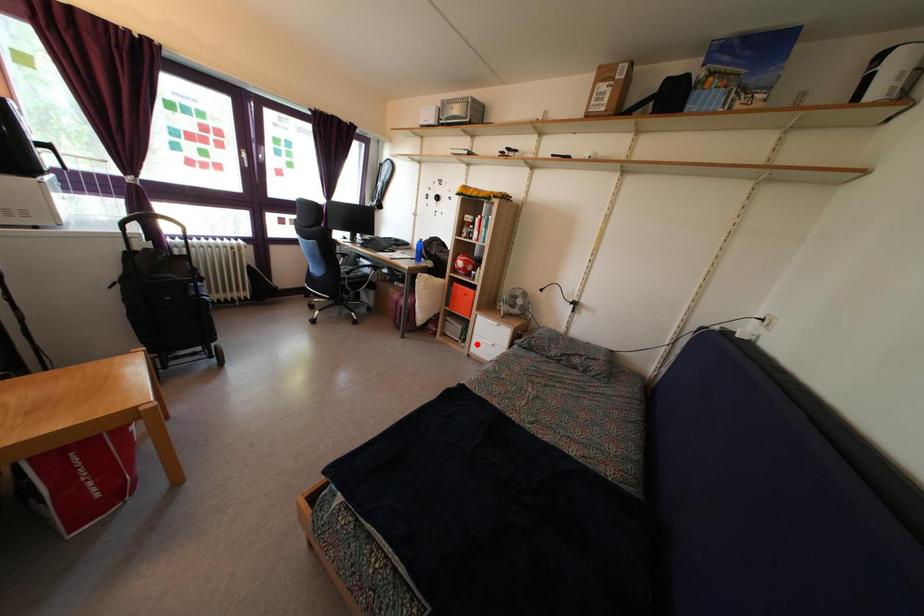
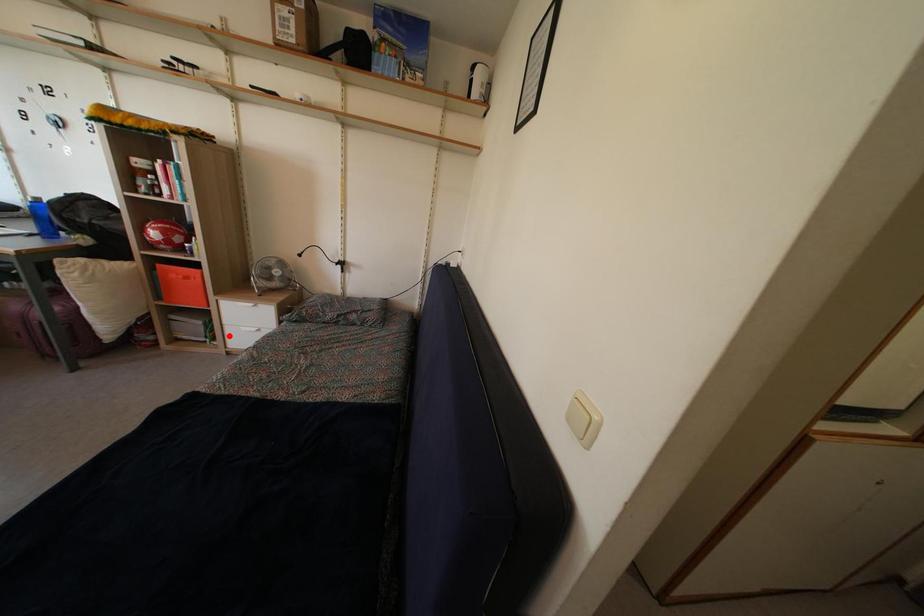
I am providing you with two images of the same scene from different viewpoints. A red point is marked on the first image and another point is marked on the second image. Does the point marked in image1 correspond to the same location as the one in image2?

Yes